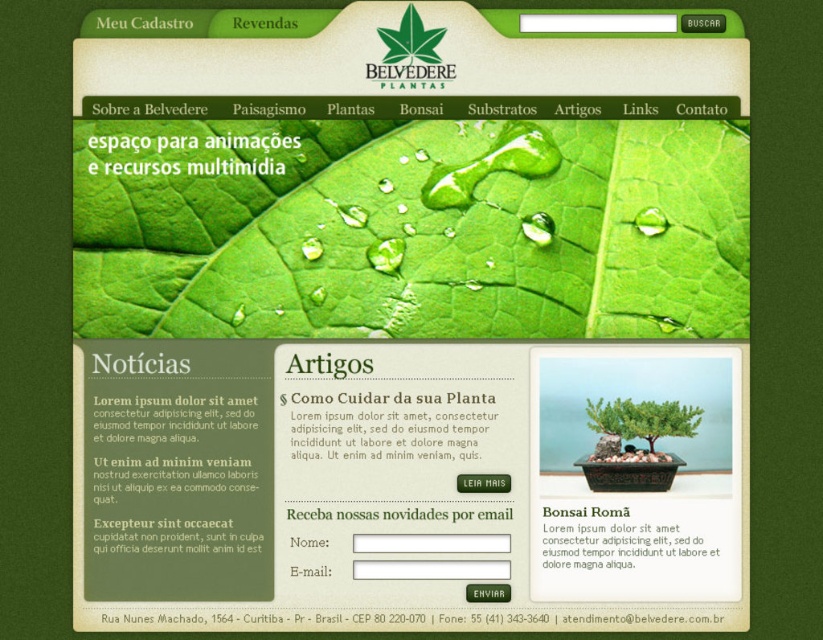
Is point (675, 404) behind point (419, 49)?

No, it is not.

Is point (602, 416) positioned in front of point (401, 32)?

No, (602, 416) is further to viewer.

Image resolution: width=823 pixels, height=640 pixels. Identify the location of green matte bonsai tree at center. (642, 419).

Does green glossy leaf at upper center have a greater height compared to green matte bonsai tree at center?

Yes, green glossy leaf at upper center is taller than green matte bonsai tree at center.

Does green glossy leaf at upper center appear under green matte bonsai tree at center?

Incorrect, green glossy leaf at upper center is not positioned below green matte bonsai tree at center.

Between point (729, 134) and point (691, 422), which one is positioned in front?

Point (729, 134) is in front.

Image resolution: width=823 pixels, height=640 pixels. Find the location of `green glossy leaf at upper center`. green glossy leaf at upper center is located at coordinates (408, 230).

Does green glossy leaf at upper center have a lesser height compared to green matte leaf at upper center?

No, green glossy leaf at upper center is not shorter than green matte leaf at upper center.

Is green glossy leaf at upper center positioned in front of green matte leaf at upper center?

Yes, it is.

Is point (133, 182) closer to viewer compared to point (389, 44)?

Yes, it is in front of point (389, 44).

You are a GUI agent. You are given a task and a screenshot of the screen. Output one action in this format:
    pyautogui.click(x=<x>, y=<y>)
    Task: Click on the green glossy leaf at upper center
    The width and height of the screenshot is (823, 640).
    Given the screenshot: What is the action you would take?
    pyautogui.click(x=408, y=230)